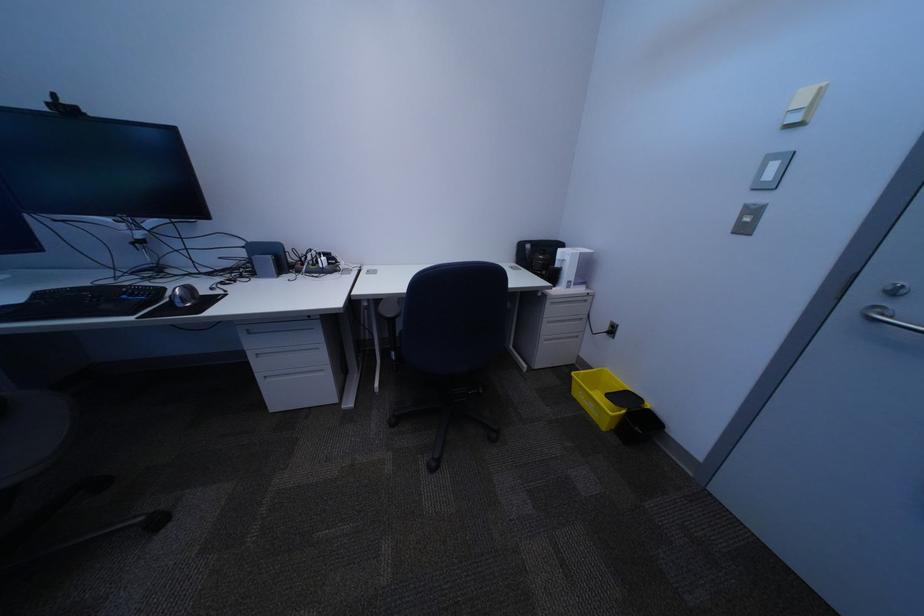
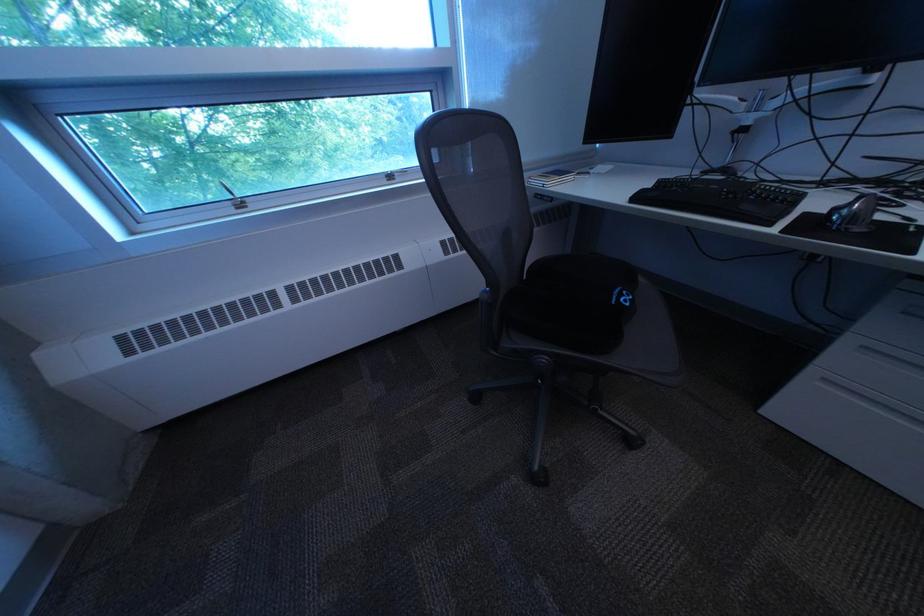
Based on the continuous images, in which direction is the camera rotating?

The rotation direction of the camera is left-down.